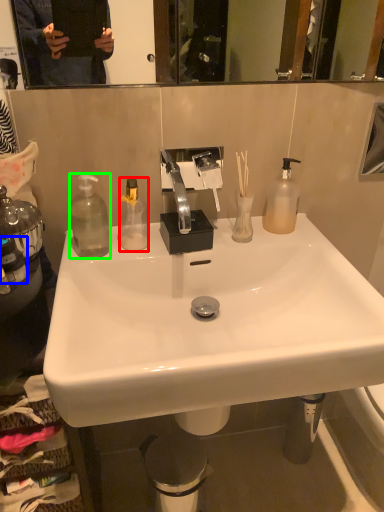
Question: Which is farther away from bottle (highlighted by a red box)? bottle (highlighted by a blue box) or bottle (highlighted by a green box)?

Choices:
 (A) bottle
 (B) bottle

Answer: (A)